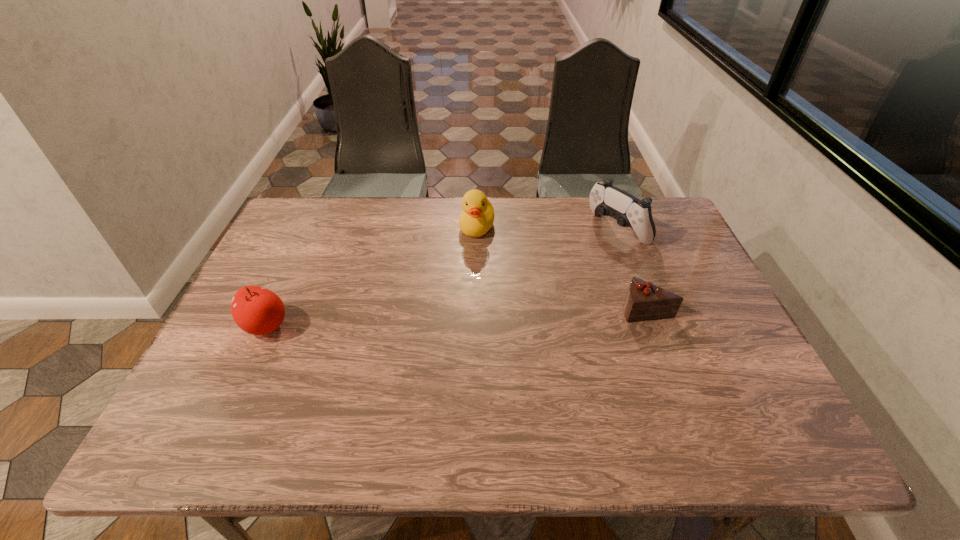
At what (x,y) coordinates should I click in order to perform the action: click on free space located 0.200m at the beak of the duck. Please return your answer as a coordinate pair (x, y). Looking at the image, I should click on (452, 287).

The height and width of the screenshot is (540, 960). I want to click on vacant space situated 0.380m at the beak of the duck, so click(x=429, y=338).

The image size is (960, 540). I want to click on control present at the far edge, so click(607, 200).

Locate an element on the screen. duck at the far edge is located at coordinates (477, 217).

This screenshot has height=540, width=960. In order to click on object that is at the left edge in this screenshot , I will do `click(256, 310)`.

Find the location of a particular element. The height and width of the screenshot is (540, 960). chocolate cake that is at the right edge is located at coordinates (644, 301).

What are the coordinates of `control that is positioned at the right edge` in the screenshot? It's located at point(607,200).

Find the location of a particular element. object situated at the far right corner is located at coordinates (607, 200).

At what (x,y) coordinates should I click in order to perform the action: click on vacant region at the far edge of the desktop. Please return your answer as a coordinate pair (x, y). This screenshot has height=540, width=960. Looking at the image, I should click on [523, 215].

The height and width of the screenshot is (540, 960). I want to click on vacant space at the near edge of the desktop, so click(421, 399).